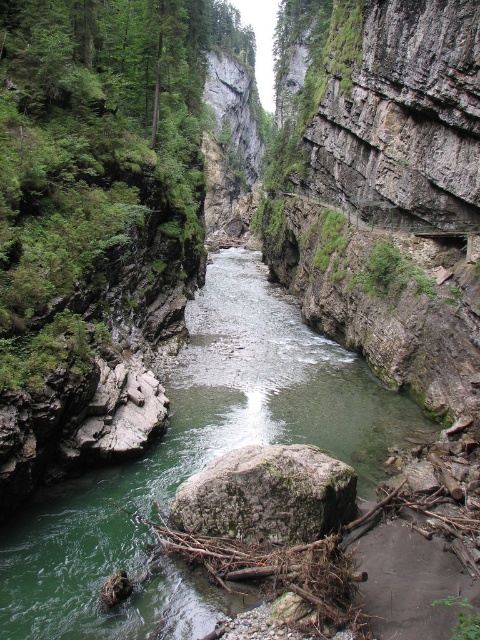
You are a hiker trying to cross the canyon using the small, rustic wooden bridge on the right. You notice two rocks in the river below the bridge. Which rock is taller, the green rock at center or the green mossy rock at center?

The green rock at center is taller than the green mossy rock at center.

You are a hiker who wants to cross the river at the bottom of the canyon. You see the green rock at center and the green mossy rock at center. Which rock is higher up in the scene?

The green rock at center is positioned over the green mossy rock at center, so the green rock at center is higher up in the scene.